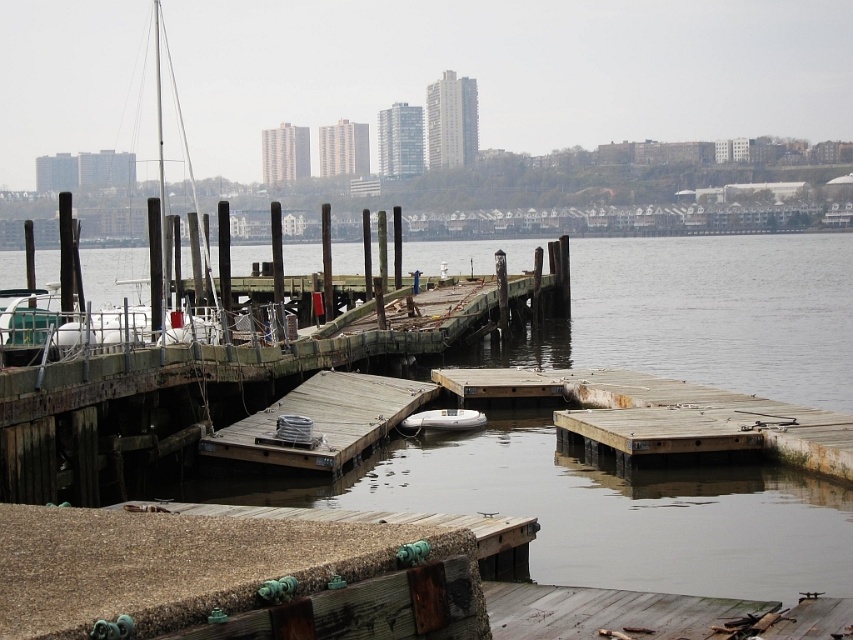
Question: Which of the following is the closest to the observer?

Choices:
 (A) (830, 308)
 (B) (427, 419)

Answer: (B)

Question: Can you confirm if brown murky water at center is thinner than rusty wood dock at center?

Choices:
 (A) yes
 (B) no

Answer: (B)

Question: Which of the following is the closest to the observer?

Choices:
 (A) (x=454, y=424)
 (B) (x=28, y=330)
 (C) (x=416, y=387)
 (D) (x=840, y=397)

Answer: (B)

Question: Where is weathered wood dock at center located in relation to white rubber boat at center in the image?

Choices:
 (A) left
 (B) right

Answer: (A)

Question: Which point appears closest to the camera in this image?

Choices:
 (A) (21, 330)
 (B) (781, 438)

Answer: (B)

Question: Is brown murky water at center positioned at the back of rusty wood dock at center?

Choices:
 (A) yes
 (B) no

Answer: (B)